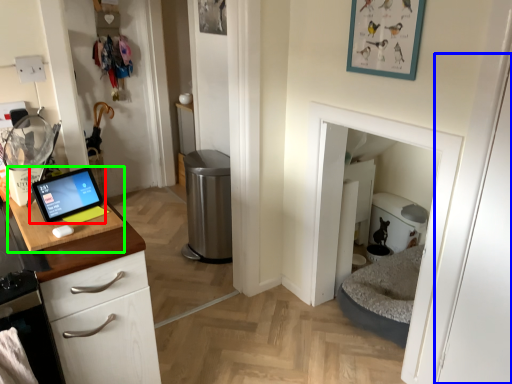
Question: Which is farther away from tablet computer (highlighted by a red box)? door (highlighted by a blue box) or sink (highlighted by a green box)?

Choices:
 (A) door
 (B) sink

Answer: (A)